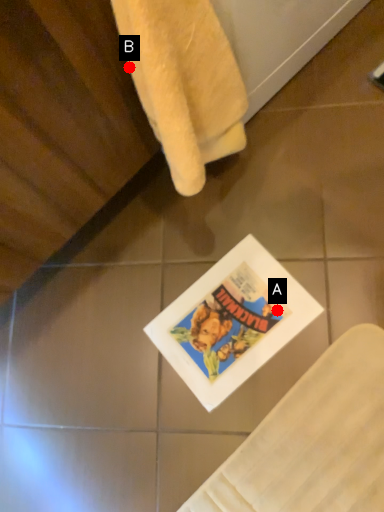
Question: Two points are circled on the image, labeled by A and B beside each circle. Which point appears closest to the camera in this image?

Choices:
 (A) A is closer
 (B) B is closer

Answer: (B)